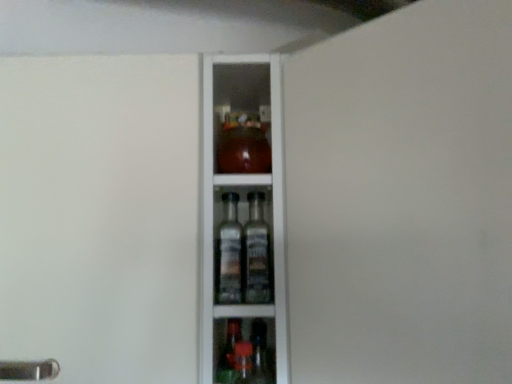
Describe the element at coordinates (402, 199) in the screenshot. I see `transparent glass cabinet at center, the 1th screen door when ordered from right to left` at that location.

You are a GUI agent. You are given a task and a screenshot of the screen. Output one action in this format:
    pyautogui.click(x=<x>, y=<y>)
    Task: Click on the transparent glass cabinet at center, positioned as the second screen door in left-to-right order
    The image size is (512, 384).
    Given the screenshot: What is the action you would take?
    pyautogui.click(x=402, y=199)

The height and width of the screenshot is (384, 512). Find the location of `transparent glass cabinet at center, placed as the second screen door when sorted from right to left`. transparent glass cabinet at center, placed as the second screen door when sorted from right to left is located at coordinates (100, 216).

Image resolution: width=512 pixels, height=384 pixels. What do you see at coordinates (100, 216) in the screenshot?
I see `transparent glass cabinet at center, placed as the 1th screen door when sorted from left to right` at bounding box center [100, 216].

This screenshot has height=384, width=512. I want to click on transparent glass cabinet at center, positioned as the second screen door in left-to-right order, so click(x=402, y=199).

Which is more to the left, transparent glass cabinet at center, the 1th screen door when ordered from right to left, or transparent glass cabinet at center, placed as the second screen door when sorted from right to left?

transparent glass cabinet at center, placed as the second screen door when sorted from right to left.

Which object is closer to the camera taking this photo, transparent glass cabinet at center, the 1th screen door when ordered from right to left, or transparent glass cabinet at center, placed as the 1th screen door when sorted from left to right?

transparent glass cabinet at center, the 1th screen door when ordered from right to left, is more forward.

Considering the points (346, 110) and (22, 100), which point is in front, point (346, 110) or point (22, 100)?

The point (346, 110) is closer to the camera.

From the image's perspective, is transparent glass cabinet at center, positioned as the second screen door in left-to-right order, positioned above or below transparent glass cabinet at center, placed as the second screen door when sorted from right to left?

Clearly, from the image's perspective, transparent glass cabinet at center, positioned as the second screen door in left-to-right order, is above transparent glass cabinet at center, placed as the second screen door when sorted from right to left.

From a real-world perspective, relative to transparent glass cabinet at center, placed as the second screen door when sorted from right to left, is transparent glass cabinet at center, the 1th screen door when ordered from right to left, vertically above or below?

From a real-world perspective, transparent glass cabinet at center, the 1th screen door when ordered from right to left, is physically below transparent glass cabinet at center, placed as the second screen door when sorted from right to left.

Considering the relative sizes of transparent glass cabinet at center, the 1th screen door when ordered from right to left, and transparent glass cabinet at center, placed as the second screen door when sorted from right to left, in the image provided, is transparent glass cabinet at center, the 1th screen door when ordered from right to left, wider than transparent glass cabinet at center, placed as the second screen door when sorted from right to left,?

Incorrect, the width of transparent glass cabinet at center, the 1th screen door when ordered from right to left, does not surpass that of transparent glass cabinet at center, placed as the second screen door when sorted from right to left.

Looking at this image, from their relative heights in the image, would you say transparent glass cabinet at center, positioned as the second screen door in left-to-right order, is taller or shorter than transparent glass cabinet at center, placed as the 1th screen door when sorted from left to right?

transparent glass cabinet at center, positioned as the second screen door in left-to-right order, is taller than transparent glass cabinet at center, placed as the 1th screen door when sorted from left to right.

Considering the sizes of objects transparent glass cabinet at center, the 1th screen door when ordered from right to left, and transparent glass cabinet at center, placed as the 1th screen door when sorted from left to right, in the image provided, who is bigger, transparent glass cabinet at center, the 1th screen door when ordered from right to left, or transparent glass cabinet at center, placed as the 1th screen door when sorted from left to right,?

transparent glass cabinet at center, placed as the 1th screen door when sorted from left to right.

Is transparent glass cabinet at center, placed as the second screen door when sorted from right to left, completely or partially inside transparent glass cabinet at center, positioned as the second screen door in left-to-right order?

No, transparent glass cabinet at center, placed as the second screen door when sorted from right to left, is not inside transparent glass cabinet at center, positioned as the second screen door in left-to-right order.

Is transparent glass cabinet at center, positioned as the second screen door in left-to-right order, positioned far away from transparent glass cabinet at center, placed as the 1th screen door when sorted from left to right?

No, there isn't a large distance between transparent glass cabinet at center, positioned as the second screen door in left-to-right order, and transparent glass cabinet at center, placed as the 1th screen door when sorted from left to right.

Is transparent glass cabinet at center, positioned as the second screen door in left-to-right order, facing towards transparent glass cabinet at center, placed as the second screen door when sorted from right to left?

No, transparent glass cabinet at center, positioned as the second screen door in left-to-right order, is not turned towards transparent glass cabinet at center, placed as the second screen door when sorted from right to left.

Can you tell me how much transparent glass cabinet at center, positioned as the second screen door in left-to-right order, and transparent glass cabinet at center, placed as the second screen door when sorted from right to left, differ in facing direction?

The angle between the facing direction of transparent glass cabinet at center, positioned as the second screen door in left-to-right order, and the facing direction of transparent glass cabinet at center, placed as the second screen door when sorted from right to left, is 45.4 degrees.

Measure the distance from transparent glass cabinet at center, the 1th screen door when ordered from right to left, to transparent glass cabinet at center, placed as the 1th screen door when sorted from left to right.

A distance of 12.70 inches exists between transparent glass cabinet at center, the 1th screen door when ordered from right to left, and transparent glass cabinet at center, placed as the 1th screen door when sorted from left to right.

This screenshot has width=512, height=384. In order to click on screen door on the right of transparent glass cabinet at center, placed as the 1th screen door when sorted from left to right in this screenshot , I will do `click(402, 199)`.

Consider the image. Which is more to the left, transparent glass cabinet at center, placed as the 1th screen door when sorted from left to right, or transparent glass cabinet at center, positioned as the second screen door in left-to-right order?

Positioned to the left is transparent glass cabinet at center, placed as the 1th screen door when sorted from left to right.

Considering the positions of objects transparent glass cabinet at center, placed as the 1th screen door when sorted from left to right, and transparent glass cabinet at center, the 1th screen door when ordered from right to left, in the image provided, who is in front, transparent glass cabinet at center, placed as the 1th screen door when sorted from left to right, or transparent glass cabinet at center, the 1th screen door when ordered from right to left,?

transparent glass cabinet at center, the 1th screen door when ordered from right to left, is in front.

Is point (91, 81) behind point (433, 268)?

Yes, point (91, 81) is farther from viewer.

Based on the photo, from the image's perspective, who appears lower, transparent glass cabinet at center, placed as the 1th screen door when sorted from left to right, or transparent glass cabinet at center, the 1th screen door when ordered from right to left?

transparent glass cabinet at center, placed as the 1th screen door when sorted from left to right, appears lower in the image.

From a real-world perspective, which is physically below, transparent glass cabinet at center, placed as the 1th screen door when sorted from left to right, or transparent glass cabinet at center, the 1th screen door when ordered from right to left?

transparent glass cabinet at center, the 1th screen door when ordered from right to left.

Does transparent glass cabinet at center, placed as the second screen door when sorted from right to left, have a greater width compared to transparent glass cabinet at center, the 1th screen door when ordered from right to left?

Yes, transparent glass cabinet at center, placed as the second screen door when sorted from right to left, is wider than transparent glass cabinet at center, the 1th screen door when ordered from right to left.

In terms of height, does transparent glass cabinet at center, placed as the second screen door when sorted from right to left, look taller or shorter compared to transparent glass cabinet at center, the 1th screen door when ordered from right to left?

transparent glass cabinet at center, placed as the second screen door when sorted from right to left, is shorter than transparent glass cabinet at center, the 1th screen door when ordered from right to left.

Based on their sizes in the image, would you say transparent glass cabinet at center, placed as the second screen door when sorted from right to left, is bigger or smaller than transparent glass cabinet at center, positioned as the second screen door in left-to-right order?

Clearly, transparent glass cabinet at center, placed as the second screen door when sorted from right to left, is larger in size than transparent glass cabinet at center, positioned as the second screen door in left-to-right order.

Is transparent glass cabinet at center, placed as the 1th screen door when sorted from left to right, spatially inside transparent glass cabinet at center, positioned as the second screen door in left-to-right order, or outside of it?

transparent glass cabinet at center, placed as the 1th screen door when sorted from left to right, is not enclosed by transparent glass cabinet at center, positioned as the second screen door in left-to-right order.

Does transparent glass cabinet at center, placed as the second screen door when sorted from right to left, touch transparent glass cabinet at center, the 1th screen door when ordered from right to left?

No, transparent glass cabinet at center, placed as the second screen door when sorted from right to left, is not next to transparent glass cabinet at center, the 1th screen door when ordered from right to left.

Based on the photo, is transparent glass cabinet at center, placed as the second screen door when sorted from right to left, facing away from transparent glass cabinet at center, positioned as the second screen door in left-to-right order?

No.

Where is `screen door below the transparent glass cabinet at center, positioned as the second screen door in left-to-right order (from the image's perspective)`? The height and width of the screenshot is (384, 512). screen door below the transparent glass cabinet at center, positioned as the second screen door in left-to-right order (from the image's perspective) is located at coordinates (100, 216).

You are a GUI agent. You are given a task and a screenshot of the screen. Output one action in this format:
    pyautogui.click(x=<x>, y=<y>)
    Task: Click on the screen door above the transparent glass cabinet at center, the 1th screen door when ordered from right to left (from a real-world perspective)
    The width and height of the screenshot is (512, 384).
    Given the screenshot: What is the action you would take?
    pyautogui.click(x=100, y=216)

The image size is (512, 384). I want to click on screen door located behind the transparent glass cabinet at center, positioned as the second screen door in left-to-right order, so click(100, 216).